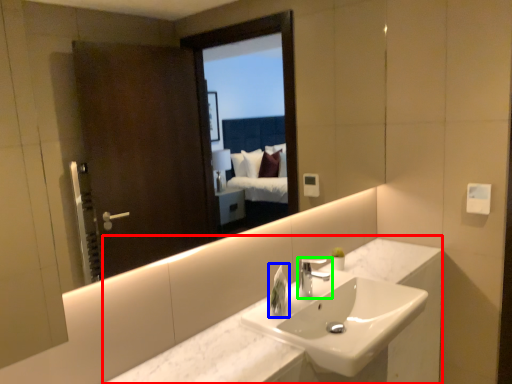
Question: Considering the real-world distances, which object is farthest from counter (highlighted by a red box)? soap dispenser (highlighted by a blue box) or tap (highlighted by a green box)?

Choices:
 (A) soap dispenser
 (B) tap

Answer: (A)